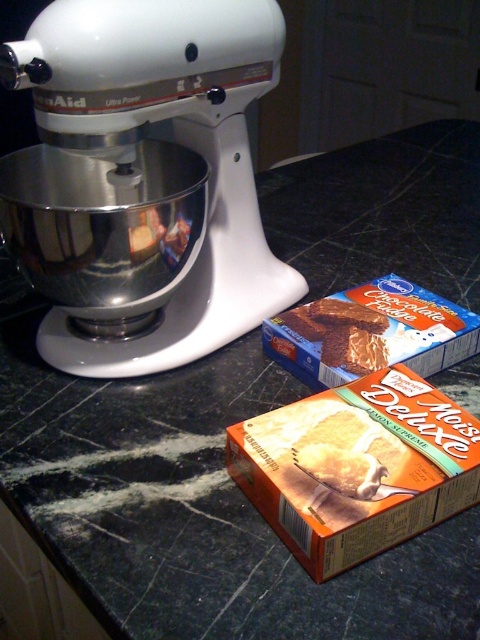
Does orange cardboard cake mix box at lower right have a smaller size compared to blue cardboard box at center?

Yes, orange cardboard cake mix box at lower right is smaller than blue cardboard box at center.

Who is positioned more to the left, orange cardboard cake mix box at lower right or blue cardboard box at center?

Positioned to the left is orange cardboard cake mix box at lower right.

Find the location of a particular element. orange cardboard cake mix box at lower right is located at coordinates (357, 467).

Locate an element on the screen. orange cardboard cake mix box at lower right is located at coordinates (357, 467).

Where is `white glossy stand mixer at left`? white glossy stand mixer at left is located at coordinates (177, 140).

Is the position of white glossy stand mixer at left more distant than that of orange cardboard cake mix box at lower right?

Yes.

Does point (82, 355) come in front of point (408, 397)?

No, (82, 355) is further to viewer.

Where is `white glossy stand mixer at left`? white glossy stand mixer at left is located at coordinates (177, 140).

Between white glossy stand mixer at left and blue cardboard box at center, which one has less height?

blue cardboard box at center is shorter.

Which is behind, point (256, 17) or point (316, 365)?

Point (316, 365)

At what (x,y) coordinates should I click in order to perform the action: click on white glossy stand mixer at left. Please return your answer as a coordinate pair (x, y). Looking at the image, I should click on (177, 140).